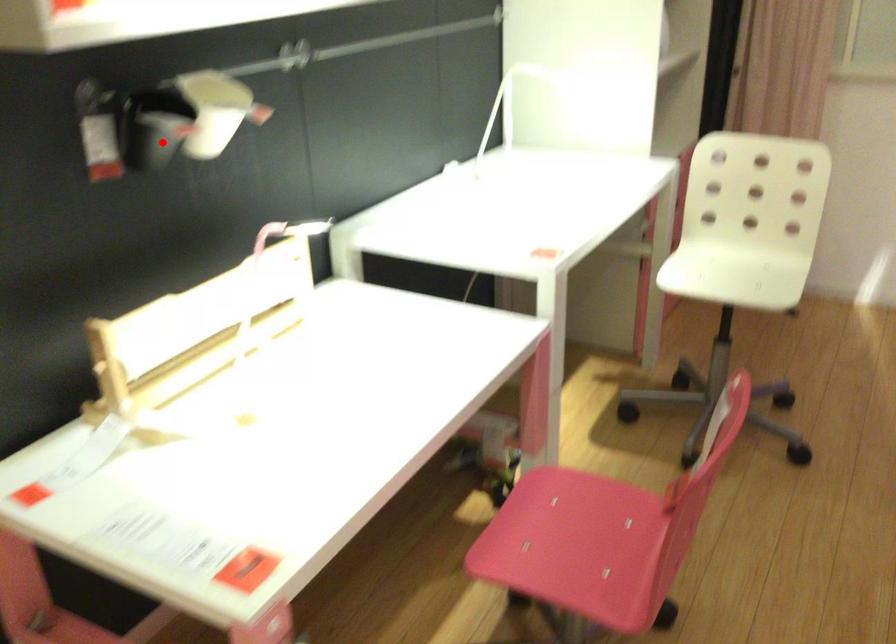
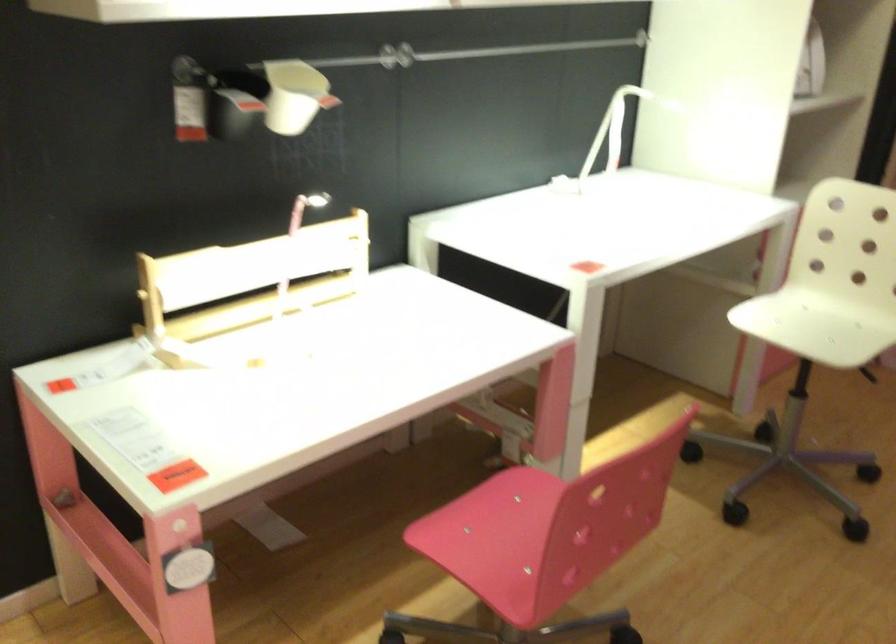
Find the pixel in the second image that matches the highlighted location in the first image.

(227, 114)